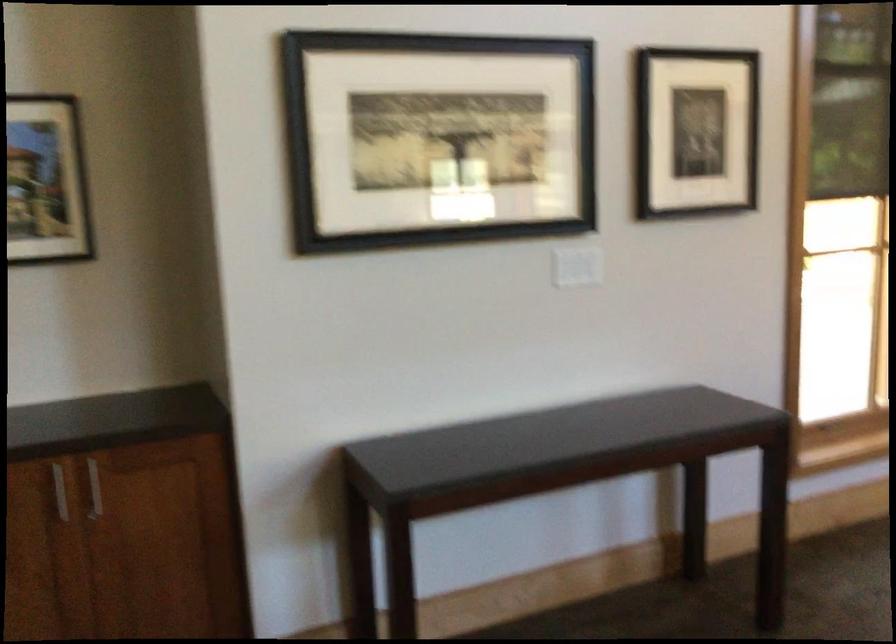
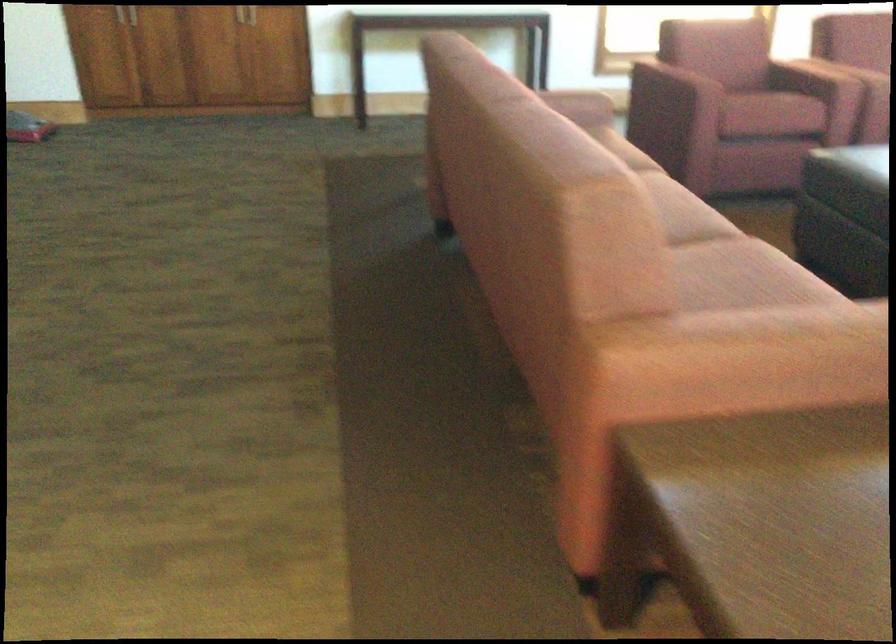
In a continuous first-person perspective shot, in which direction is the camera moving?

The cameraman walked toward right, backward.